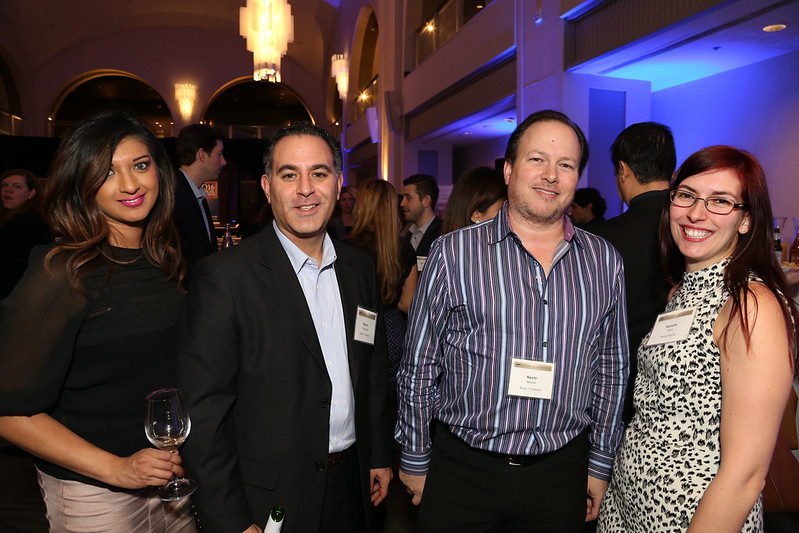
Where is `chandelier`? chandelier is located at coordinates (272, 28).